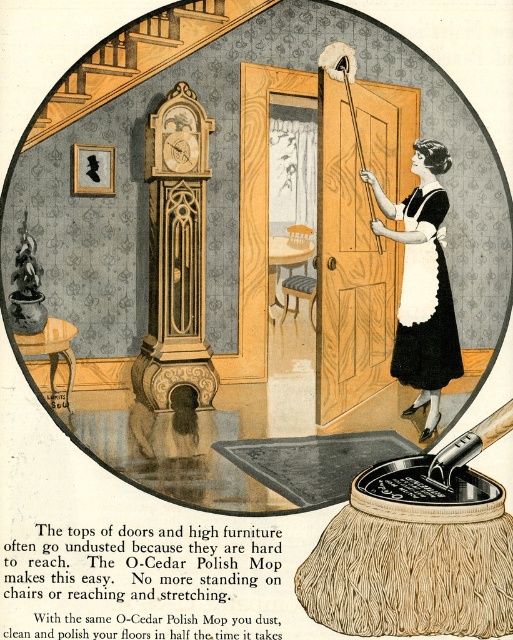
You are a tailor observing the vintage advertisement and notice two aprons. The black cotton apron at upper right and the white cotton apron at center. Which apron is wider?

The black cotton apron at upper right is wider than the white cotton apron at center.